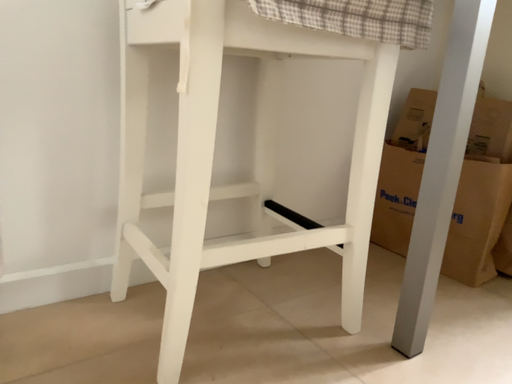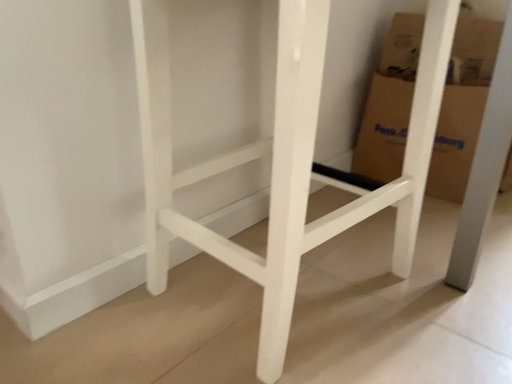
Question: Which way did the camera rotate in the video?

Choices:
 (A) rotated left
 (B) rotated right

Answer: (B)